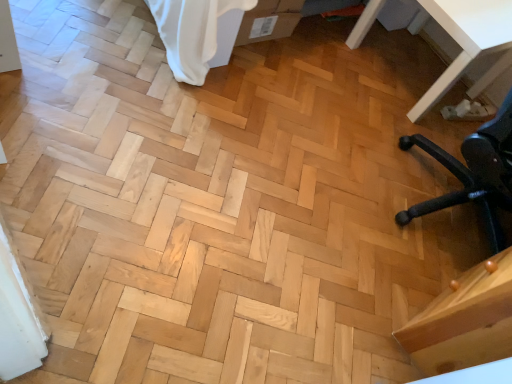
In order to face white plastic table at lower right, should I rotate leftwards or rightwards?

To face it directly, rotate right by 23.753 degrees.

At what (x,y) coordinates should I click in order to perform the action: click on white plastic table at lower right. Please return your answer as a coordinate pair (x, y). This screenshot has width=512, height=384. Looking at the image, I should click on (466, 42).

The height and width of the screenshot is (384, 512). What do you see at coordinates (466, 42) in the screenshot?
I see `white plastic table at lower right` at bounding box center [466, 42].

Locate an element on the screen. white plastic table at lower right is located at coordinates (466, 42).